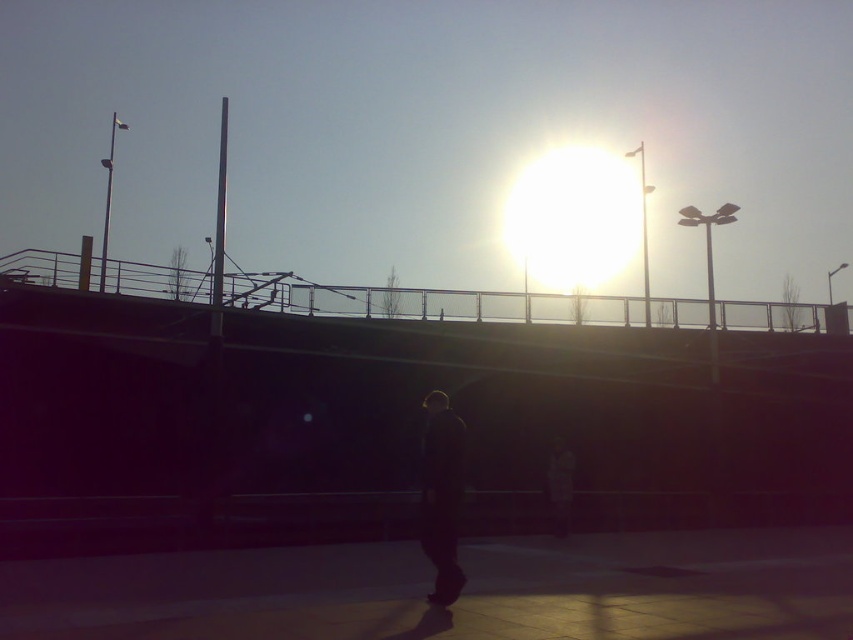
You are standing at point (x=440, y=496) in the image. What object is located at your current position?

The dark fabric jacket at center is located at point (x=440, y=496).

You are a photographer trying to capture a silhouette of two people wearing jackets. You notice that the dark fabric jacket at center and the dark gray jacket at center are positioned in front of the bright sunlight. Which jacket would appear narrower in the photo?

The dark fabric jacket at center appears narrower in the photo because its width is less than the dark gray jacket at center.